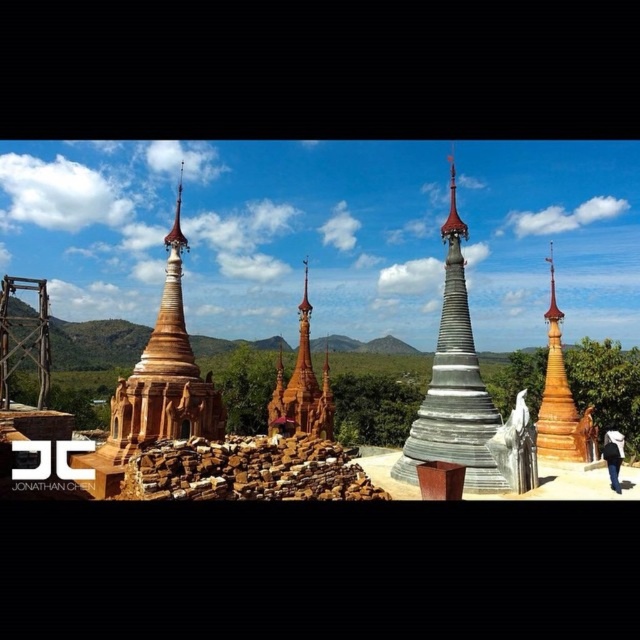
Does matte brown pagoda at left have a smaller size compared to silver metallic stupa at center?

Actually, matte brown pagoda at left might be larger than silver metallic stupa at center.

Measure the distance between point (144,349) and camera.

Point (144,349) is 260.76 feet from camera.

Where is `matte brown pagoda at left`? Image resolution: width=640 pixels, height=640 pixels. matte brown pagoda at left is located at coordinates (157, 387).

Which is in front, point (173, 275) or point (612, 458)?

Point (173, 275) is in front.

Who is more distant from viewer, (132, 384) or (612, 461)?

Positioned behind is point (612, 461).

Where is `matte brown pagoda at left`? Image resolution: width=640 pixels, height=640 pixels. matte brown pagoda at left is located at coordinates (157, 387).

Which is behind, point (177, 356) or point (300, 337)?

The point (300, 337) is more distant.

Is point (113, 397) closer to camera compared to point (272, 422)?

Yes, point (113, 397) is closer to viewer.

Who is more forward, (166, 241) or (316, 422)?

Positioned in front is point (166, 241).

Image resolution: width=640 pixels, height=640 pixels. I want to click on matte brown pagoda at left, so click(x=157, y=387).